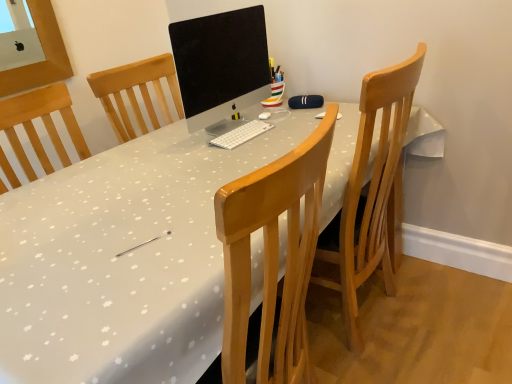
Question: Does light brown wooden chair at center have a larger size compared to white glossy desk at center?

Choices:
 (A) yes
 (B) no

Answer: (B)

Question: Is light brown wooden chair at center at the right side of white glossy desk at center?

Choices:
 (A) no
 (B) yes

Answer: (B)

Question: Does light brown wooden chair at center lie in front of white glossy desk at center?

Choices:
 (A) yes
 (B) no

Answer: (B)

Question: Considering the relative sizes of light brown wooden chair at center and white glossy desk at center in the image provided, is light brown wooden chair at center wider than white glossy desk at center?

Choices:
 (A) no
 (B) yes

Answer: (A)

Question: From the image's perspective, is light brown wooden chair at center above white glossy desk at center?

Choices:
 (A) yes
 (B) no

Answer: (A)

Question: Considering the relative positions of light brown wooden chair at center and white glossy desk at center in the image provided, is light brown wooden chair at center behind white glossy desk at center?

Choices:
 (A) yes
 (B) no

Answer: (A)

Question: Is matte black monitor at center taller than light brown wooden chair at center?

Choices:
 (A) yes
 (B) no

Answer: (B)

Question: Does matte black monitor at center turn towards light brown wooden chair at center?

Choices:
 (A) yes
 (B) no

Answer: (A)

Question: Is matte black monitor at center completely or partially outside of light brown wooden chair at center?

Choices:
 (A) no
 (B) yes

Answer: (B)

Question: Is light brown wooden chair at center surrounded by matte black monitor at center?

Choices:
 (A) no
 (B) yes

Answer: (A)

Question: Can you see matte black monitor at center touching light brown wooden chair at center?

Choices:
 (A) no
 (B) yes

Answer: (A)

Question: Does matte black monitor at center have a lesser height compared to light brown wooden chair at center?

Choices:
 (A) yes
 (B) no

Answer: (A)

Question: Does matte black monitor at center have a greater width compared to white glossy desk at center?

Choices:
 (A) yes
 (B) no

Answer: (B)